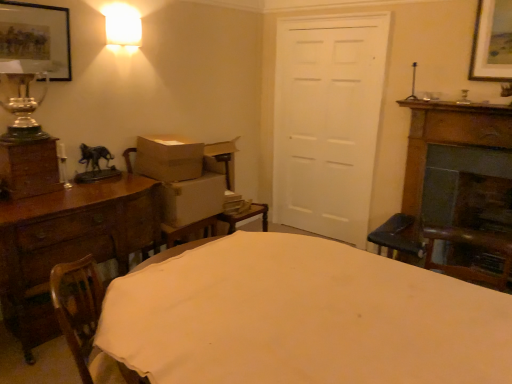
This screenshot has width=512, height=384. In order to click on vacant region above white matte door at center (from a real-world perspective) in this screenshot , I will do `click(336, 17)`.